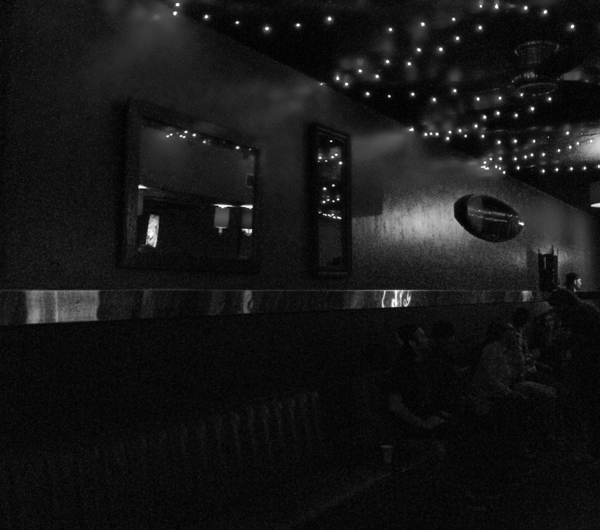
Where is `cup`? cup is located at coordinates (388, 456).